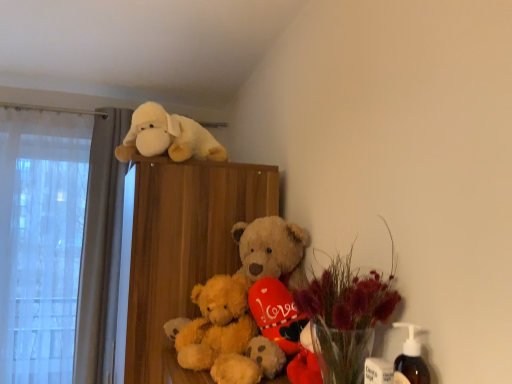
Question: Is fluffy golden teddy bear at center bigger or smaller than translucent glass vase at center, which appears as the first floral arrangement when viewed from the back?

Choices:
 (A) big
 (B) small

Answer: (B)

Question: In the image, is fluffy golden teddy bear at center positioned in front of or behind translucent glass vase at center, the 2th floral arrangement in the front-to-back sequence?

Choices:
 (A) behind
 (B) front

Answer: (A)

Question: Estimate the real-world distances between objects in this image. Which object is closer to the translucent glass vase at center, which appears as the first floral arrangement when viewed from the back?

Choices:
 (A) translucent glass vase with dried flowers at lower right, which is the first floral arrangement from front to back
 (B) fluffy golden teddy bear at center
 (C) fluffy white plush dog at upper center
 (D) wooden bookshelf at upper center

Answer: (B)

Question: Estimate the real-world distances between objects in this image. Which object is farther from the wooden bookshelf at upper center?

Choices:
 (A) fluffy golden teddy bear at center
 (B) translucent glass vase with dried flowers at lower right, which is the first floral arrangement from front to back
 (C) translucent glass vase at center, the 2th floral arrangement in the front-to-back sequence
 (D) fluffy white plush dog at upper center

Answer: (B)